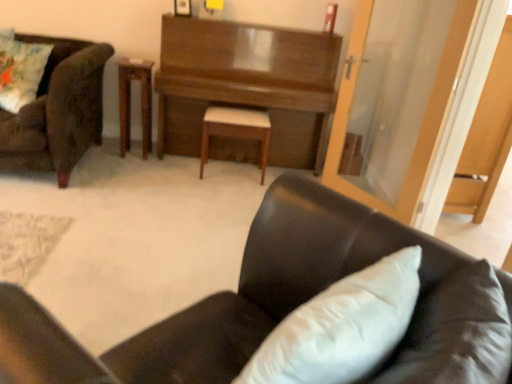
Identify the location of empty space that is in between wooden table at center and white leather stool at center. This screenshot has width=512, height=384. (175, 166).